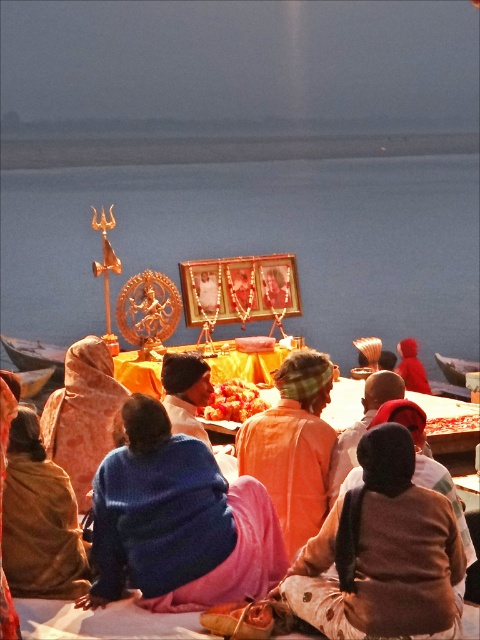
Question: Which of the following is the farthest from the observer?

Choices:
 (A) 398,346
 (B) 103,445
 (C) 290,492
 (D) 183,616

Answer: (A)

Question: Is orange printed fabric robe at center closer to camera compared to matte red shawl at center?

Choices:
 (A) yes
 (B) no

Answer: (A)

Question: Which point appears farthest from the camera in this image?

Choices:
 (A) click(x=67, y=596)
 (B) click(x=406, y=355)

Answer: (B)

Question: Can you confirm if brown cotton robe at lower right is positioned to the right of orange cotton robe at center?

Choices:
 (A) no
 (B) yes

Answer: (B)

Question: Which point is farther from the camera taking this photo?

Choices:
 (A) (8, 552)
 (B) (276, 458)

Answer: (B)

Question: Can you confirm if brown cotton robe at lower right is bigger than orange printed fabric robe at center?

Choices:
 (A) no
 (B) yes

Answer: (A)